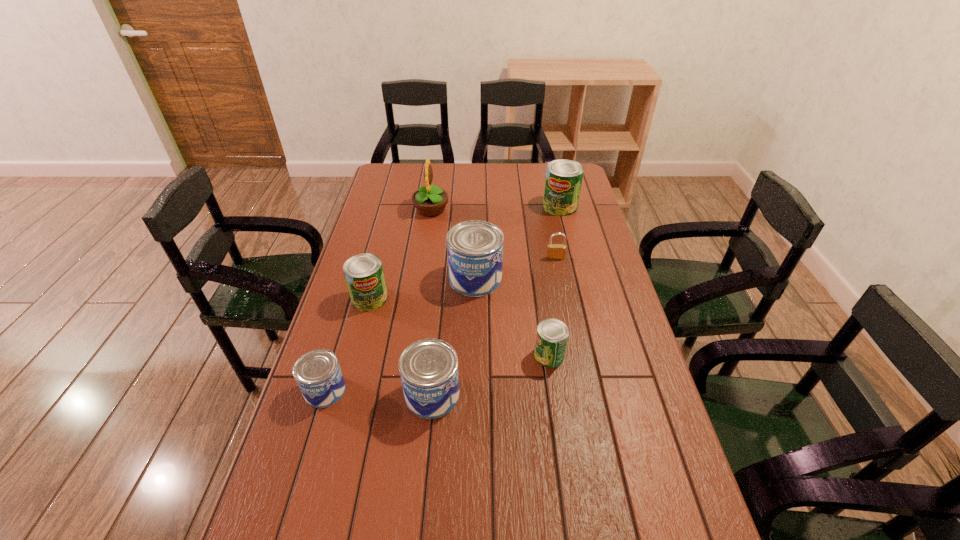
Identify the location of the tallest object. (429, 200).

What are the coordinates of `yellow sunflower` in the screenshot? It's located at (429, 200).

Where is `the farthest green can`? The width and height of the screenshot is (960, 540). the farthest green can is located at coordinates (563, 181).

Find the location of a particular element. This screenshot has width=960, height=540. the biggest green can is located at coordinates (563, 181).

Identify the location of the farthest blue can. The width and height of the screenshot is (960, 540). (475, 248).

Image resolution: width=960 pixels, height=540 pixels. Find the location of `the second biggest green can`. the second biggest green can is located at coordinates (364, 275).

Identify the location of the second farthest green can. (364, 275).

Find the location of a particular element. the second smallest blue can is located at coordinates (428, 368).

Image resolution: width=960 pixels, height=540 pixels. In order to click on padlock in this screenshot , I will do `click(554, 251)`.

In order to click on brass padlock in this screenshot , I will do `click(554, 251)`.